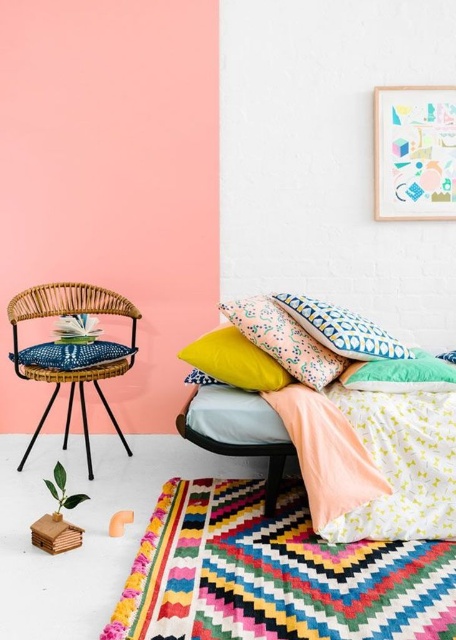
Question: Does multicolored woven quilt at lower center appear under blue patterned pillow at center?

Choices:
 (A) no
 (B) yes

Answer: (B)

Question: Which point is closer to the camera?

Choices:
 (A) (238, 353)
 (B) (263, 339)

Answer: (B)

Question: Is the position of multicolored woven quilt at lower center more distant than that of textured cotton bed at center?

Choices:
 (A) yes
 (B) no

Answer: (B)

Question: Is yellow fabric quilt at center to the right of green fabric pillow at center from the viewer's perspective?

Choices:
 (A) no
 (B) yes

Answer: (A)

Question: Which point is closer to the camera?

Choices:
 (A) yellow matte pillow at center
 (B) patterned fabric pillow at center
 (C) wooden picture frame at upper right
 (D) blue patterned pillow at center

Answer: (D)

Question: Among these points, which one is nearest to the camera?

Choices:
 (A) (180, 566)
 (B) (333, 403)
 (C) (383, 333)
 (D) (31, 442)

Answer: (A)